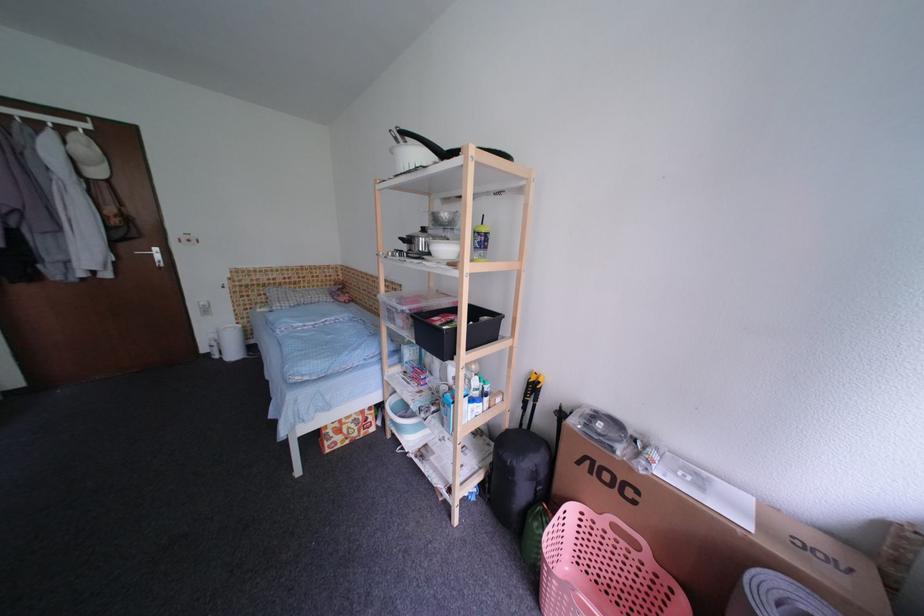
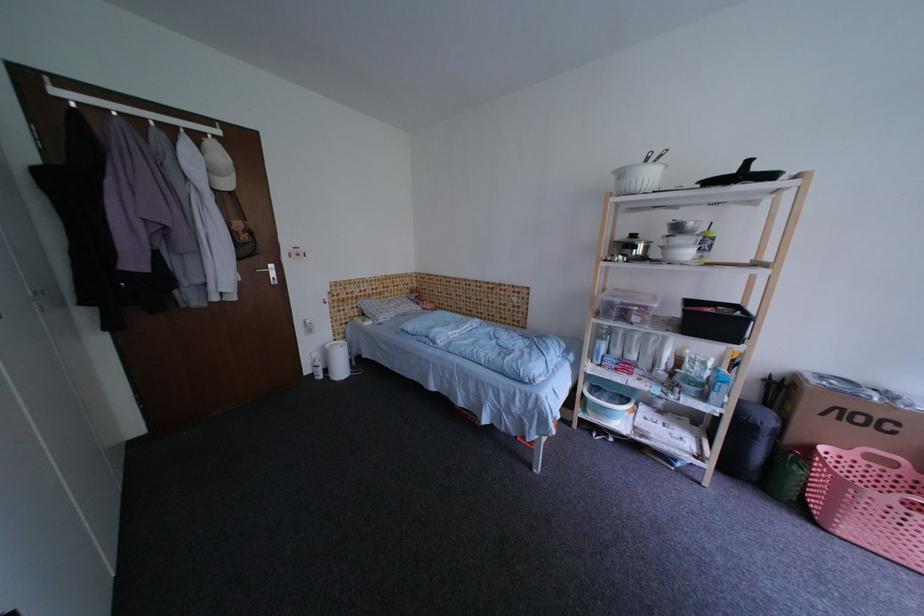
In the second image, find the point that corresponds to [529,553] in the first image.

(776, 496)